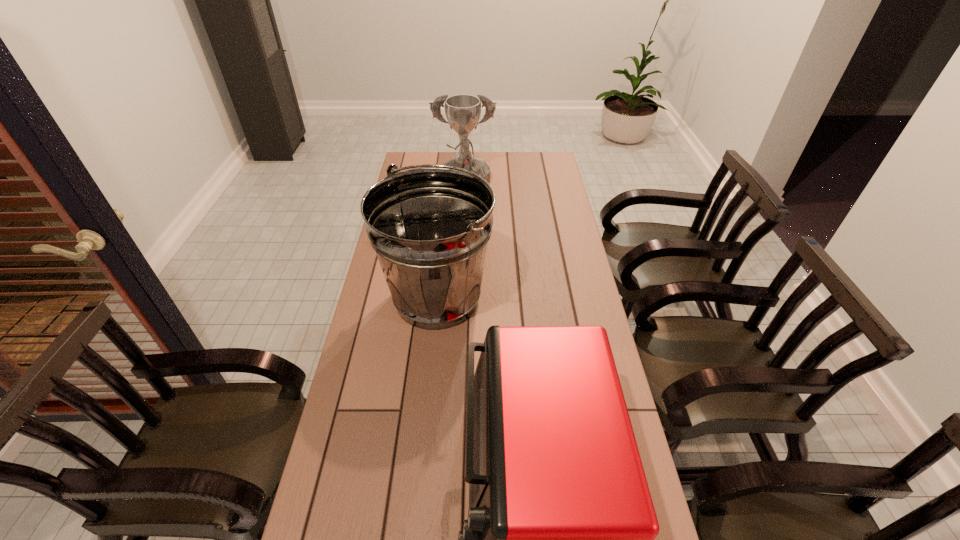
What are the coordinates of `the closest object to the shortest object` in the screenshot? It's located at (430, 227).

Locate which object is the closest to the toaster oven. Please provide its 2D coordinates. Your answer should be formatted as a tuple, i.e. [(x, y)], where the tuple contains the x and y coordinates of a point satisfying the conditions above.

[(430, 227)]